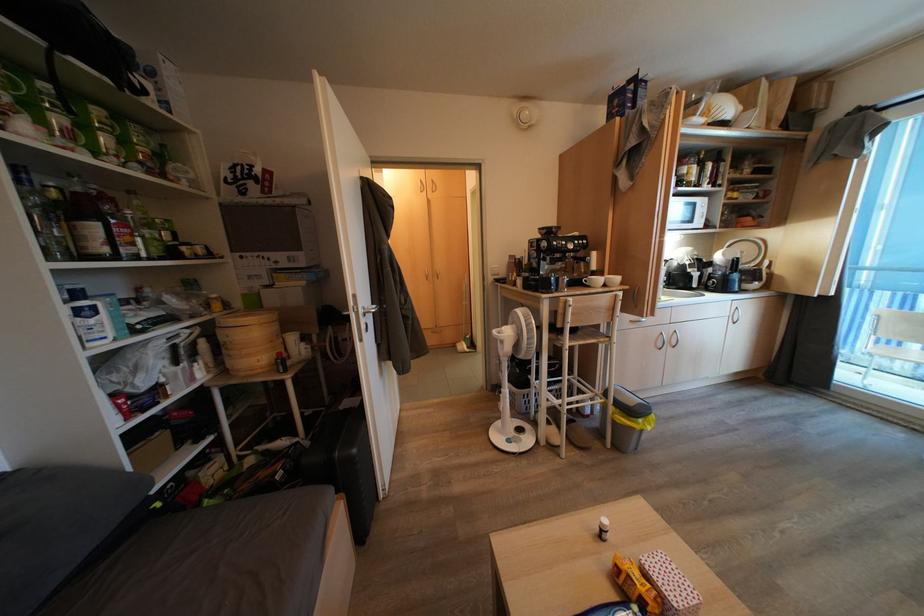
Find where to lift the small white bottle. Please return your answer as a coordinate pair (x, y).

(602, 528)